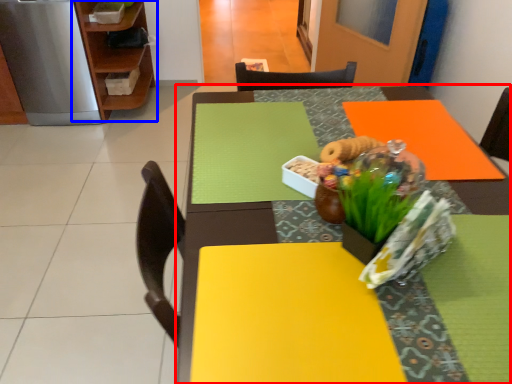
Question: Which point is closer to the camera, table (highlighted by a red box) or shelf (highlighted by a blue box)?

Choices:
 (A) table
 (B) shelf

Answer: (A)